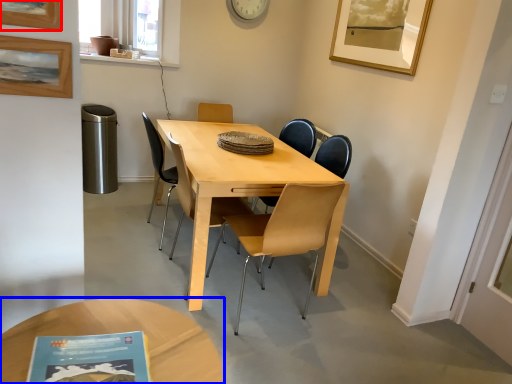
Question: Which object appears farthest to the camera in this image, picture frame (highlighted by a red box) or coffee table (highlighted by a blue box)?

Choices:
 (A) picture frame
 (B) coffee table

Answer: (A)